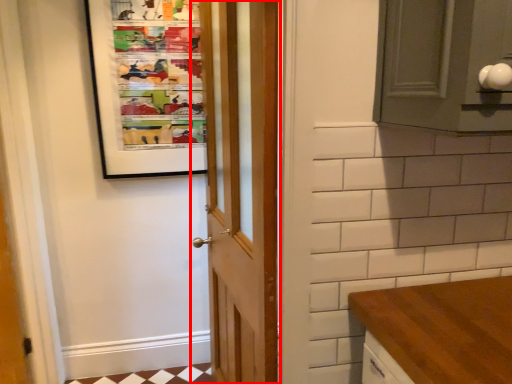
Question: From the image's perspective, considering the relative positions of door (annotated by the red box) and bulletin board in the image provided, where is door (annotated by the red box) located with respect to the staircase?

Choices:
 (A) above
 (B) below

Answer: (B)